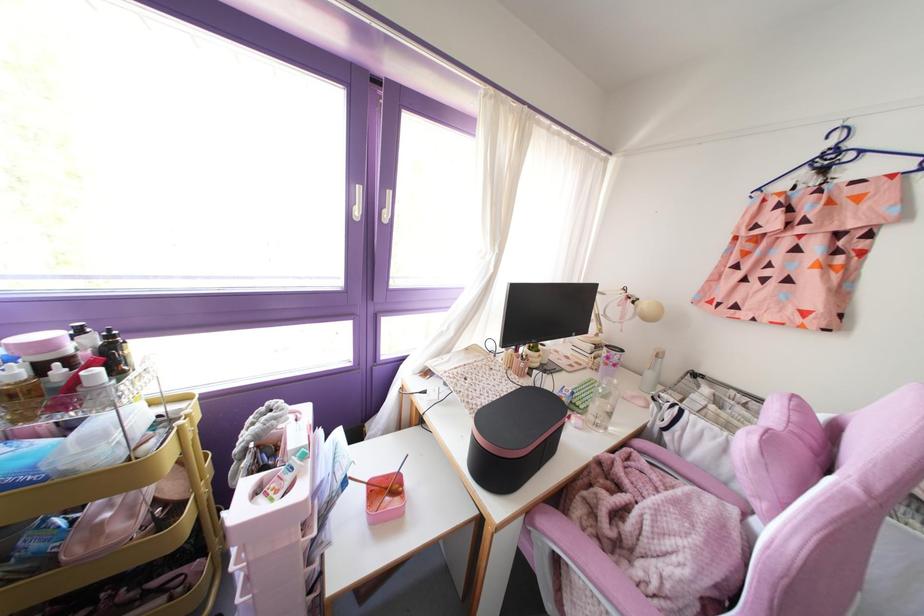
Image resolution: width=924 pixels, height=616 pixels. Find the location of `pink chair armrest`. pink chair armrest is located at coordinates (579, 564).